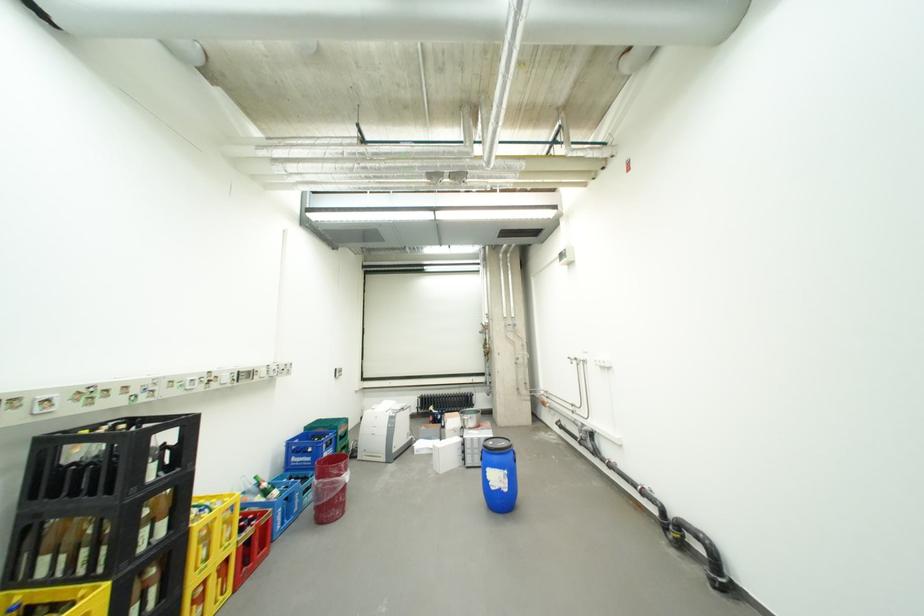
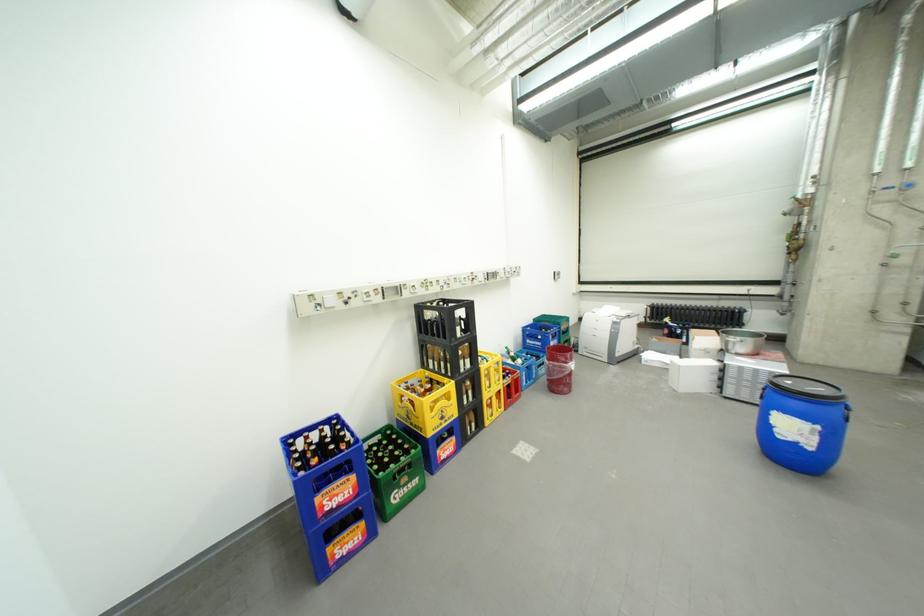
Find the pixel in the second image that matches the point at 502,445 in the first image.

(799, 383)